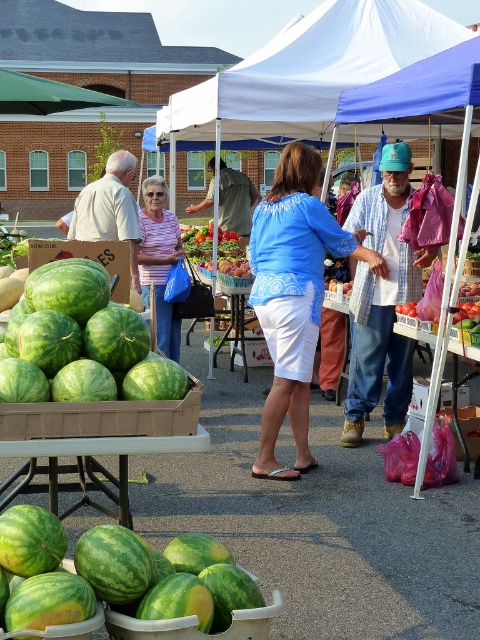
Question: Which point appears farthest from the camera in this image?

Choices:
 (A) (273, 419)
 (B) (43, 385)
 (C) (418, 253)

Answer: (C)

Question: Can you confirm if wooden crate at lower left is wider than striped shirt at center?

Choices:
 (A) yes
 (B) no

Answer: (A)

Question: Which point is farther from the camera taking this photo?

Choices:
 (A) (264, 92)
 (B) (276, 218)
 (C) (154, 282)

Answer: (A)

Question: Is white fabric canopy at upper center above green textured shirt at center?

Choices:
 (A) no
 (B) yes

Answer: (B)

Question: Which object is the farthest from the green fabric canopy at upper left?

Choices:
 (A) green matte watermelon at lower left
 (B) green textured shirt at center

Answer: (A)

Question: Does wooden crate at lower left appear on the right side of shiny red tomatoes at center?

Choices:
 (A) yes
 (B) no

Answer: (B)